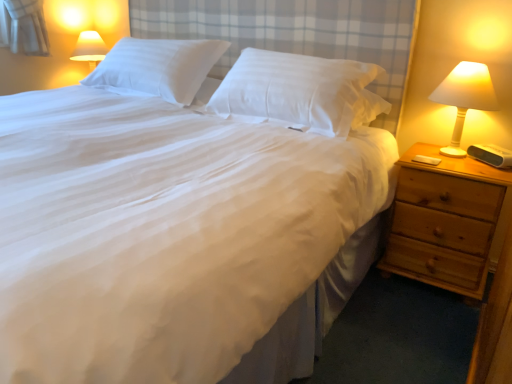
Describe the element at coordinates (298, 91) in the screenshot. I see `white smooth pillow at center, which is counted as the first pillow, starting from the right` at that location.

The height and width of the screenshot is (384, 512). What do you see at coordinates (445, 221) in the screenshot?
I see `light brown wooden nightstand at right` at bounding box center [445, 221].

Image resolution: width=512 pixels, height=384 pixels. I want to click on white smooth pillow at center, which is counted as the first pillow, starting from the right, so click(298, 91).

Is white smooth pillow at center, the 2th pillow from the left, taller than white plastic lamp at right?

No.

From a real-world perspective, is white smooth pillow at center, which is counted as the first pillow, starting from the right, physically above white plastic lamp at right?

Yes, from a real-world perspective, white smooth pillow at center, which is counted as the first pillow, starting from the right, is over white plastic lamp at right

Is white smooth pillow at center, which is counted as the first pillow, starting from the right, facing away from white plastic lamp at right?

No, white smooth pillow at center, which is counted as the first pillow, starting from the right,'s orientation is not away from white plastic lamp at right.

You are a GUI agent. You are given a task and a screenshot of the screen. Output one action in this format:
    pyautogui.click(x=<x>, y=<y>)
    Task: Click on the bedside lamp on the right side of white smooth pillow at center, the 2th pillow from the left
    This screenshot has width=512, height=384.
    Given the screenshot: What is the action you would take?
    pyautogui.click(x=465, y=98)

From a real-world perspective, count 1st pillows upward from the light brown wooden nightstand at right and point to it. Please provide its 2D coordinates.

[(298, 91)]

Looking at this image, from a real-world perspective, between light brown wooden nightstand at right and white smooth pillow at center, which is counted as the first pillow, starting from the right, who is vertically higher?

white smooth pillow at center, which is counted as the first pillow, starting from the right.

Can you confirm if light brown wooden nightstand at right is thinner than white smooth pillow at center, the 2th pillow from the left?

Incorrect, the width of light brown wooden nightstand at right is not less than that of white smooth pillow at center, the 2th pillow from the left.

Who is bigger, white smooth pillow at upper center, the 2th pillow in the right-to-left sequence, or white smooth pillow at center, which is counted as the first pillow, starting from the right?

With larger size is white smooth pillow at center, which is counted as the first pillow, starting from the right.

Is white smooth pillow at upper center, the 2th pillow in the right-to-left sequence, far away from white smooth pillow at center, the 2th pillow from the left?

They are positioned close to each other.

From the image's perspective, is white smooth pillow at upper center, the 2th pillow in the right-to-left sequence, on white smooth pillow at center, which is counted as the first pillow, starting from the right?

Yes, from the image's perspective, white smooth pillow at upper center, the 2th pillow in the right-to-left sequence, is over white smooth pillow at center, which is counted as the first pillow, starting from the right.

From their relative heights in the image, would you say white smooth pillow at upper center, the 2th pillow in the right-to-left sequence, is taller or shorter than white smooth pillow at center, the 2th pillow from the left?

In the image, white smooth pillow at upper center, the 2th pillow in the right-to-left sequence, appears to be shorter than white smooth pillow at center, the 2th pillow from the left.

Consider the image. From a real-world perspective, is light brown wooden nightstand at right above or below white plastic lamp at right?

Clearly, from a real-world perspective, light brown wooden nightstand at right is below white plastic lamp at right.

Is light brown wooden nightstand at right taller or shorter than white plastic lamp at right?

light brown wooden nightstand at right is taller than white plastic lamp at right.

Can you confirm if light brown wooden nightstand at right is smaller than white plastic lamp at right?

Incorrect, light brown wooden nightstand at right is not smaller in size than white plastic lamp at right.

From the image's perspective, does white smooth pillow at center, the 2th pillow from the left, appear lower than white smooth pillow at upper center, the 2th pillow in the right-to-left sequence?

Yes, from the image's perspective, white smooth pillow at center, the 2th pillow from the left, is beneath white smooth pillow at upper center, the 2th pillow in the right-to-left sequence.

Measure the distance between white smooth pillow at center, the 2th pillow from the left, and white smooth pillow at upper center, the 2th pillow in the right-to-left sequence.

white smooth pillow at center, the 2th pillow from the left, and white smooth pillow at upper center, the 2th pillow in the right-to-left sequence, are 18.92 inches apart from each other.

Is white smooth pillow at center, the 2th pillow from the left, shorter than white smooth pillow at upper center, the first pillow from the left?

Incorrect, the height of white smooth pillow at center, the 2th pillow from the left, does not fall short of that of white smooth pillow at upper center, the first pillow from the left.

What's the angular difference between white smooth pillow at center, the 2th pillow from the left, and white smooth pillow at upper center, the first pillow from the left,'s facing directions?

The angle between the facing direction of white smooth pillow at center, the 2th pillow from the left, and the facing direction of white smooth pillow at upper center, the first pillow from the left, is 0.000201 degrees.

From the image's perspective, between white plastic lamp at right and light brown wooden nightstand at right, which one is located above?

From the image's view, white plastic lamp at right is above.

Considering the relative sizes of white plastic lamp at right and light brown wooden nightstand at right in the image provided, is white plastic lamp at right bigger than light brown wooden nightstand at right?

No, white plastic lamp at right is not bigger than light brown wooden nightstand at right.

Does white plastic lamp at right lie in front of light brown wooden nightstand at right?

No, white plastic lamp at right is further to the viewer.

Considering the relative sizes of white plastic lamp at right and light brown wooden nightstand at right in the image provided, is white plastic lamp at right taller than light brown wooden nightstand at right?

In fact, white plastic lamp at right may be shorter than light brown wooden nightstand at right.

Would you say white smooth pillow at upper center, the first pillow from the left, contains white plastic lamp at right?

That's incorrect, white plastic lamp at right is not inside white smooth pillow at upper center, the first pillow from the left.

Measure the distance from white smooth pillow at upper center, the first pillow from the left, to white plastic lamp at right.

4.28 feet.

Based on the photo, from the image's perspective, is white smooth pillow at upper center, the first pillow from the left, under white plastic lamp at right?

No, from the image's perspective, white smooth pillow at upper center, the first pillow from the left, is not beneath white plastic lamp at right.

Could you tell me if white smooth pillow at upper center, the 2th pillow in the right-to-left sequence, is facing white plastic lamp at right?

No, white smooth pillow at upper center, the 2th pillow in the right-to-left sequence, is not facing towards white plastic lamp at right.

Where is `bedside lamp in front of the white smooth pillow at center, which is counted as the first pillow, starting from the right`? Image resolution: width=512 pixels, height=384 pixels. bedside lamp in front of the white smooth pillow at center, which is counted as the first pillow, starting from the right is located at coordinates (465, 98).

You are a GUI agent. You are given a task and a screenshot of the screen. Output one action in this format:
    pyautogui.click(x=<x>, y=<y>)
    Task: Click on the nightstand below the white smooth pillow at center, which is counted as the first pillow, starting from the right (from the image's perspective)
    
    Given the screenshot: What is the action you would take?
    pyautogui.click(x=445, y=221)

Looking at the image, which one is located further to white plastic lamp at right, white smooth pillow at center, the 2th pillow from the left, or light brown wooden nightstand at right?

white smooth pillow at center, the 2th pillow from the left, is further to white plastic lamp at right.

From the image, which object appears to be farther from light brown wooden nightstand at right, white smooth pillow at center, which is counted as the first pillow, starting from the right, or white smooth pillow at upper center, the first pillow from the left?

white smooth pillow at upper center, the first pillow from the left, lies further to light brown wooden nightstand at right than the other object.

From the image, which object appears to be nearer to white smooth pillow at upper center, the 2th pillow in the right-to-left sequence, light brown wooden nightstand at right or white smooth pillow at center, the 2th pillow from the left?

Among the two, white smooth pillow at center, the 2th pillow from the left, is located nearer to white smooth pillow at upper center, the 2th pillow in the right-to-left sequence.

Based on their spatial positions, is white plastic lamp at right or white smooth pillow at center, which is counted as the first pillow, starting from the right, further from white smooth pillow at upper center, the 2th pillow in the right-to-left sequence?

white plastic lamp at right.

Looking at the image, which one is located further to white smooth pillow at upper center, the 2th pillow in the right-to-left sequence, white smooth pillow at center, the 2th pillow from the left, or light brown wooden nightstand at right?

light brown wooden nightstand at right is further to white smooth pillow at upper center, the 2th pillow in the right-to-left sequence.

Considering their positions, is white smooth pillow at upper center, the first pillow from the left, positioned further to white plastic lamp at right than light brown wooden nightstand at right?

The object further to white plastic lamp at right is white smooth pillow at upper center, the first pillow from the left.

Consider the image. From the image, which object appears to be farther from white plastic lamp at right, light brown wooden nightstand at right or white smooth pillow at center, the 2th pillow from the left?

white smooth pillow at center, the 2th pillow from the left.

Based on their spatial positions, is white plastic lamp at right or white smooth pillow at upper center, the 2th pillow in the right-to-left sequence, further from light brown wooden nightstand at right?

white smooth pillow at upper center, the 2th pillow in the right-to-left sequence, lies further to light brown wooden nightstand at right than the other object.

Locate an element on the screen. The image size is (512, 384). pillow situated between white smooth pillow at upper center, the first pillow from the left, and white plastic lamp at right from left to right is located at coordinates (298, 91).

This screenshot has width=512, height=384. I want to click on pillow located between white smooth pillow at upper center, the 2th pillow in the right-to-left sequence, and light brown wooden nightstand at right in the left-right direction, so [x=298, y=91].

Where is `nightstand between white smooth pillow at upper center, the first pillow from the left, and white plastic lamp at right`? This screenshot has height=384, width=512. nightstand between white smooth pillow at upper center, the first pillow from the left, and white plastic lamp at right is located at coordinates (445, 221).

Locate an element on the screen. This screenshot has width=512, height=384. nightstand situated between white smooth pillow at center, the 2th pillow from the left, and white plastic lamp at right from left to right is located at coordinates (445, 221).